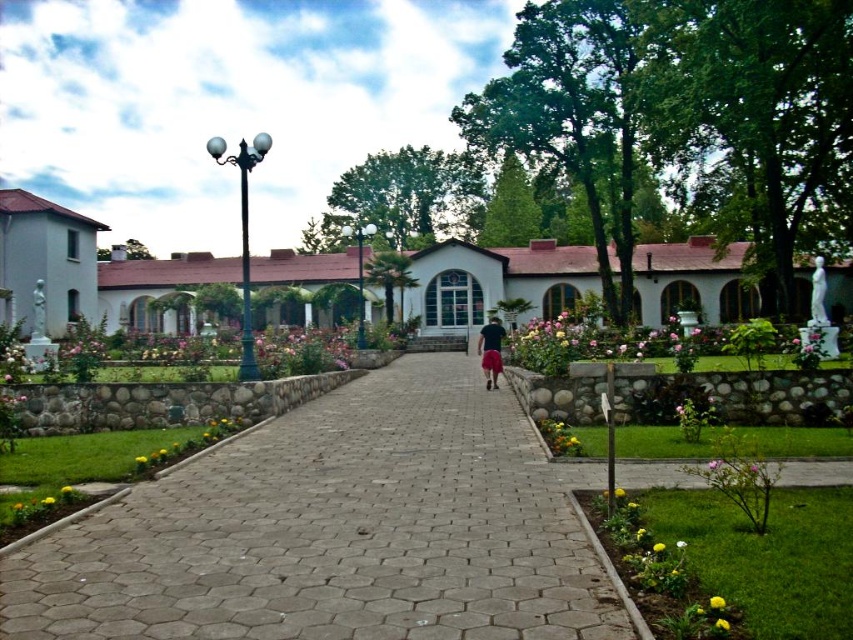
You are standing at the entrance of the garden and want to walk directly towards the building. The gray hexagonal paving stone at center is an obstacle. Can you step over it without deviating from your path?

The gray hexagonal paving stone at center is located at point (335, 531), which is directly along your path towards the building. Therefore, you would need to step over it to continue moving straight ahead without deviating.

You are a gardener who needs to place a new decorative item on the garden pathway. You have a gray hexagonal paving stone at center and black fabric shorts at center. Which object should you choose to ensure it fits within the existing pathway tiles without being too small?

The gray hexagonal paving stone at center should be chosen because its width is larger than the black fabric shorts at center, ensuring it aligns better with the existing pathway tiles.

You are standing at the entrance of the garden and want to walk towards the building. There is a gray hexagonal paving stone at center marked by point (335, 531). Can you step on this point while walking straight towards the building?

Yes, the gray hexagonal paving stone at center marked by point (335, 531) is located along the pathway leading directly to the building, so stepping on this point while walking straight is possible.